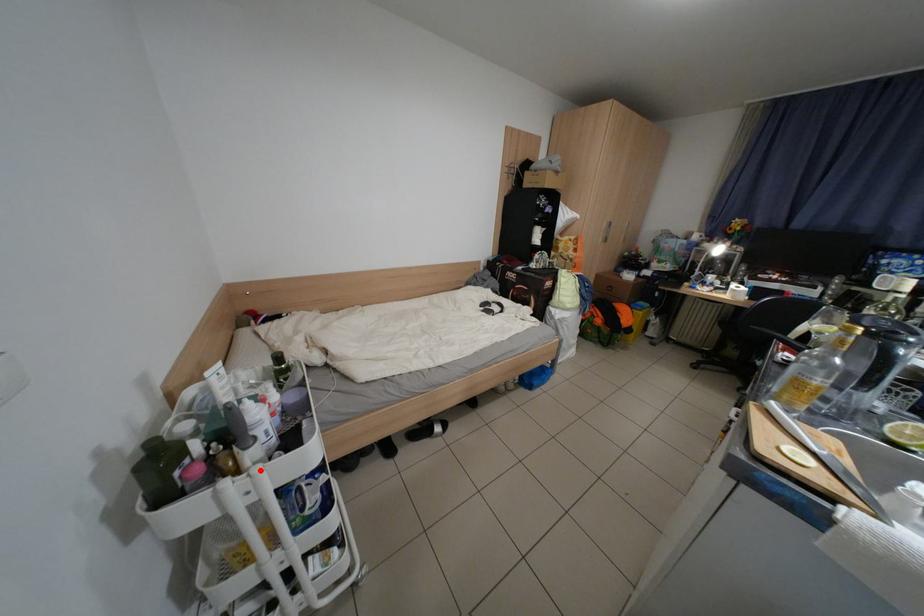
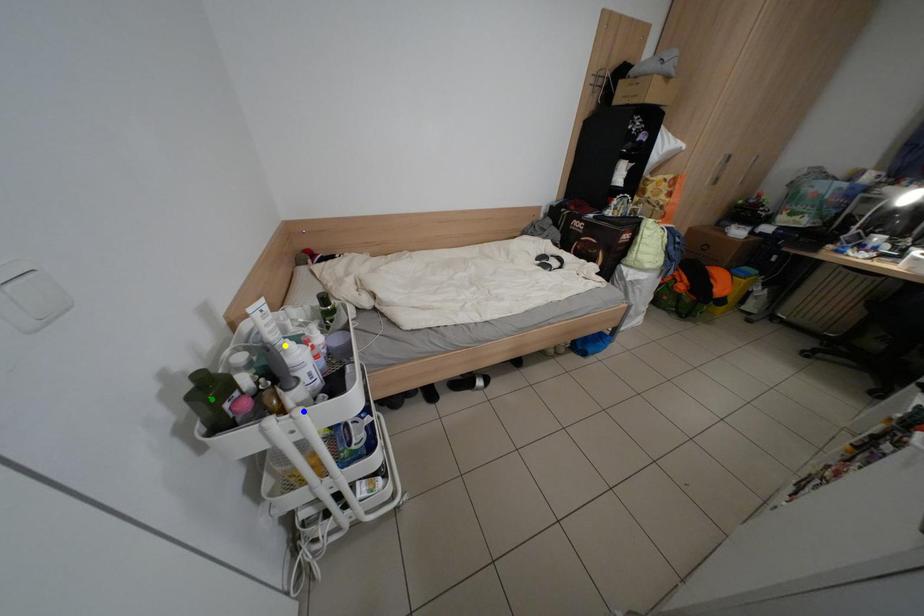
Question: I am providing you with two images of the same scene from different viewpoints. A red point is marked on the first image. You are given multiple points on the second image. In image 2, which mark is for the same physical point as the one in image 1?

Choices:
 (A) blue point
 (B) yellow point
 (C) green point

Answer: (A)